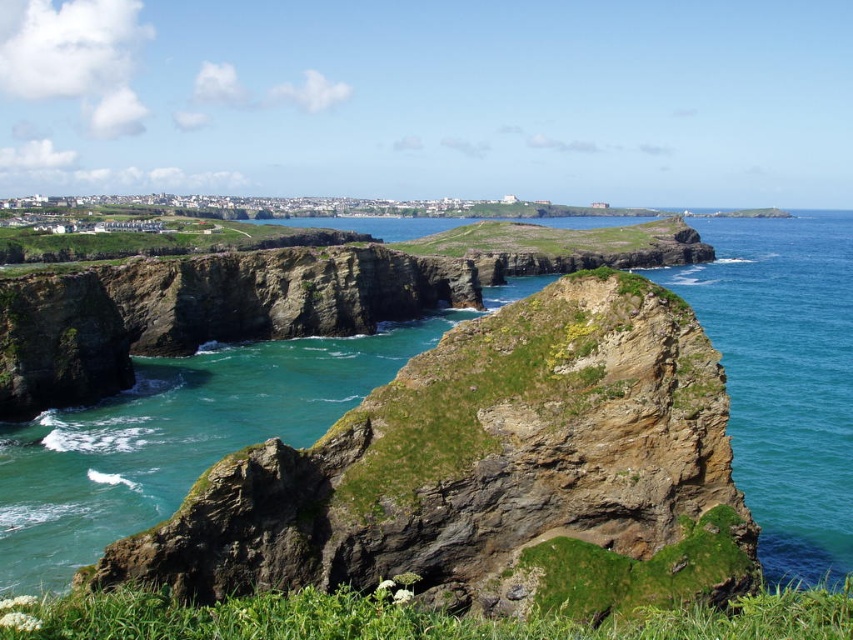
Who is higher up, brown rocky cliff at center or greenish-blue water at right?

greenish-blue water at right

Can you confirm if brown rocky cliff at center is bigger than greenish-blue water at right?

No, brown rocky cliff at center is not bigger than greenish-blue water at right.

Who is more forward, (602, 426) or (788, 440)?

Point (602, 426) is in front.

Find the location of a particular element. The image size is (853, 640). brown rocky cliff at center is located at coordinates coord(490,474).